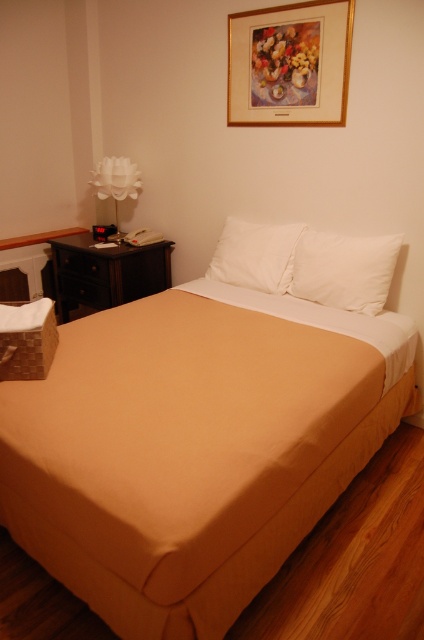
Is beige fabric bed at center taller than gold-framed artwork at upper center?

Yes.

Which is behind, point (315, 508) or point (301, 100)?

Point (301, 100)

The width and height of the screenshot is (424, 640). In order to click on beige fabric bed at center in this screenshot , I will do 194,445.

Can you confirm if beige fabric bed at center is thinner than white soft pillow at center?

In fact, beige fabric bed at center might be wider than white soft pillow at center.

Is beige fabric bed at center positioned before white soft pillow at center?

Yes, beige fabric bed at center is closer to the viewer.

Describe the element at coordinates (194, 445) in the screenshot. I see `beige fabric bed at center` at that location.

The image size is (424, 640). In order to click on beige fabric bed at center in this screenshot , I will do `click(194, 445)`.

Between beige fabric bed at center and white smooth pillow at upper right, which one is positioned higher?

white smooth pillow at upper right

Based on the photo, who is taller, beige fabric bed at center or white smooth pillow at upper right?

With more height is beige fabric bed at center.

Between point (348, 429) and point (348, 284), which one is positioned behind?

The point (348, 284) is behind.

Where is `beige fabric bed at center`? beige fabric bed at center is located at coordinates (194, 445).